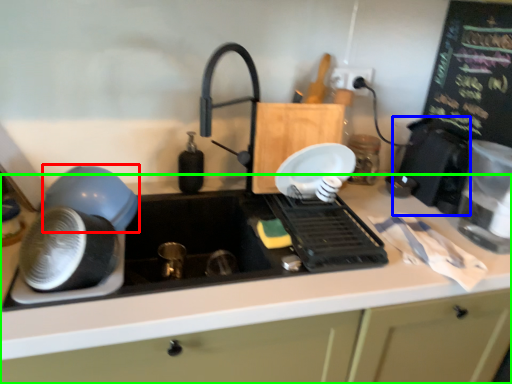
Question: Based on their relative distances, which object is nearer to kitchen appliance (highlighted by a red box)? Choose from appliance (highlighted by a blue box) and countertop (highlighted by a green box).

Choices:
 (A) appliance
 (B) countertop

Answer: (B)